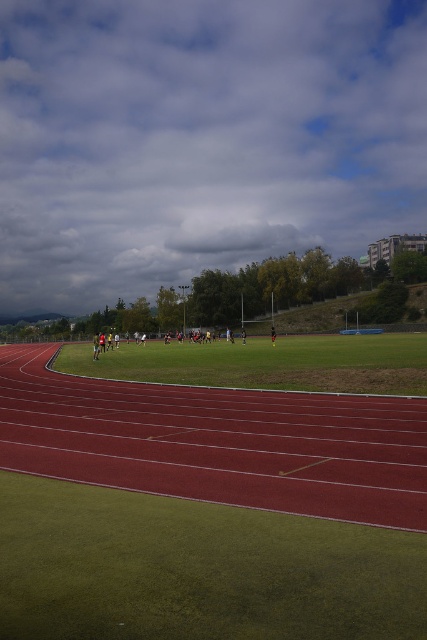
Does green grass football field at center have a larger size compared to green grass field at center?

No.

Which is behind, point (298, 557) or point (149, 378)?

The point (149, 378) is behind.

Does point (253, 595) come closer to viewer compared to point (136, 362)?

That is True.

The width and height of the screenshot is (427, 640). Find the location of `green grass football field at center`. green grass football field at center is located at coordinates (204, 513).